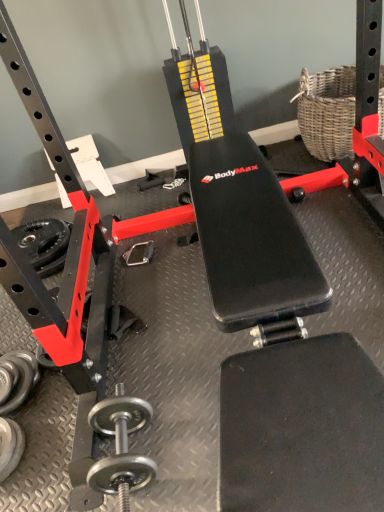
The image size is (384, 512). Identify the location of free location above rubberized black weight at lower left (from a real-world perspective). (31, 234).